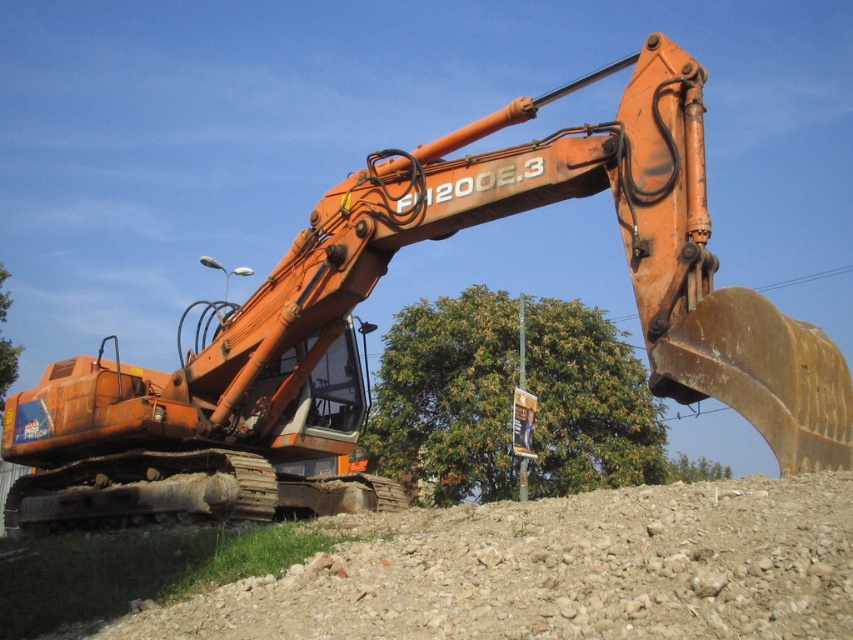
Question: Can you confirm if brown gravel at lower center is thinner than green leafy tree at lower right?

Choices:
 (A) yes
 (B) no

Answer: (A)

Question: Which object is positioned closest to the green leafy tree at center?

Choices:
 (A) green leafy tree at lower center
 (B) green leafy tree at lower right

Answer: (B)

Question: Is brown gravel at lower center to the right of green leafy tree at center from the viewer's perspective?

Choices:
 (A) no
 (B) yes

Answer: (A)

Question: Which point appears farthest from the camera in this image?

Choices:
 (A) (485, 452)
 (B) (3, 282)
 (C) (239, 593)
 (D) (714, 472)

Answer: (B)

Question: Does brown gravel at lower center come in front of green leafy tree at lower center?

Choices:
 (A) no
 (B) yes

Answer: (B)

Question: Estimate the real-world distances between objects in this image. Which object is closer to the green leafy tree at center?

Choices:
 (A) green leafy tree at lower center
 (B) green leafy tree at lower right

Answer: (B)